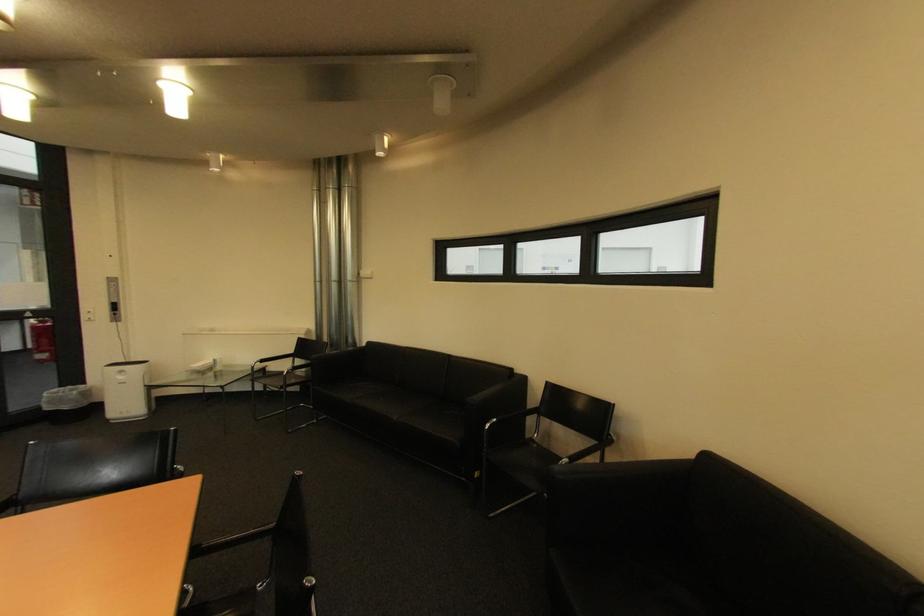
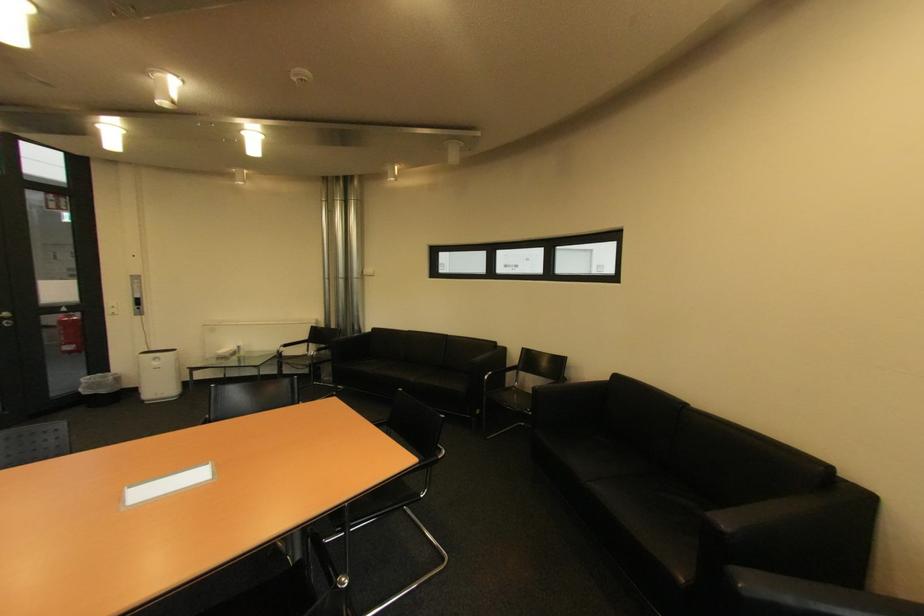
In the second image, find the point that corresponds to point 503,421 in the first image.

(499, 374)